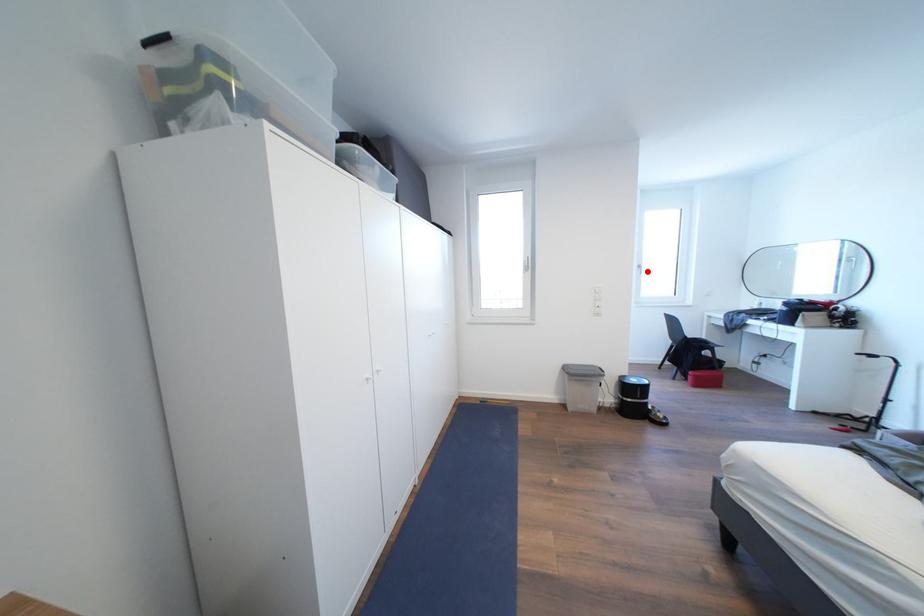
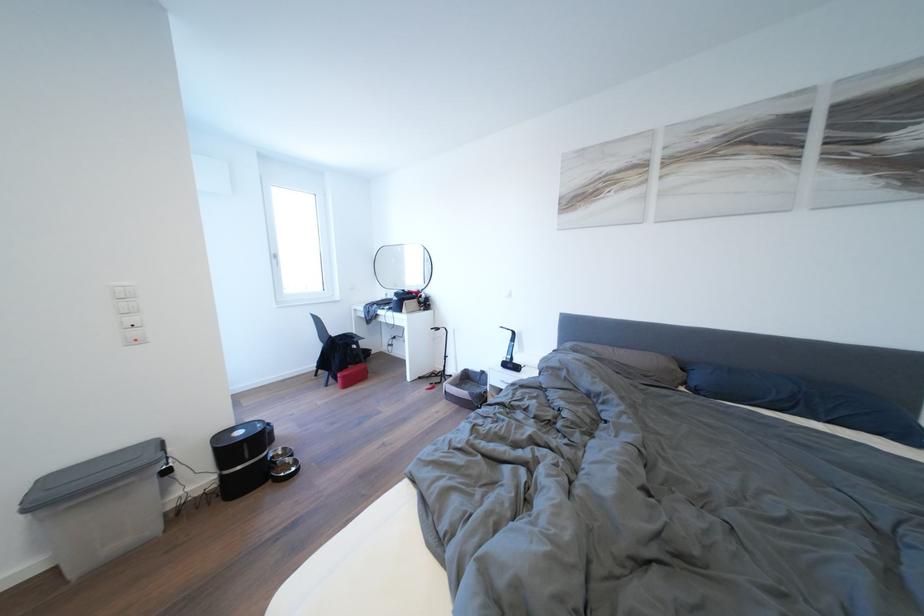
Where in the second image is the point corresponding to the highlighted location from the first image?

(284, 261)